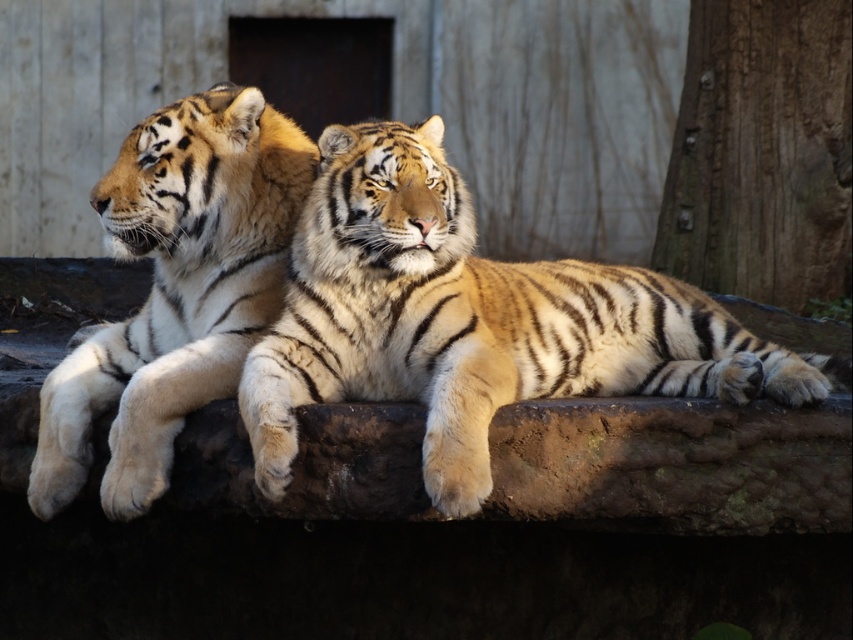
Question: Is golden fur tiger at center to the right of golden fur tiger at left from the viewer's perspective?

Choices:
 (A) no
 (B) yes

Answer: (B)

Question: Which object is the closest to the golden fur tiger at center?

Choices:
 (A) smooth bark tree trunk at right
 (B) golden fur tiger at left

Answer: (B)

Question: Which object appears closest to the camera in this image?

Choices:
 (A) smooth bark tree trunk at right
 (B) golden fur tiger at center
 (C) golden fur tiger at left

Answer: (B)

Question: Is golden fur tiger at left above smooth bark tree trunk at right?

Choices:
 (A) no
 (B) yes

Answer: (A)

Question: Is golden fur tiger at center closer to camera compared to smooth bark tree trunk at right?

Choices:
 (A) yes
 (B) no

Answer: (A)

Question: Among these points, which one is nearest to the camera?

Choices:
 (A) (207, 250)
 (B) (782, 220)
 (C) (560, 353)

Answer: (C)